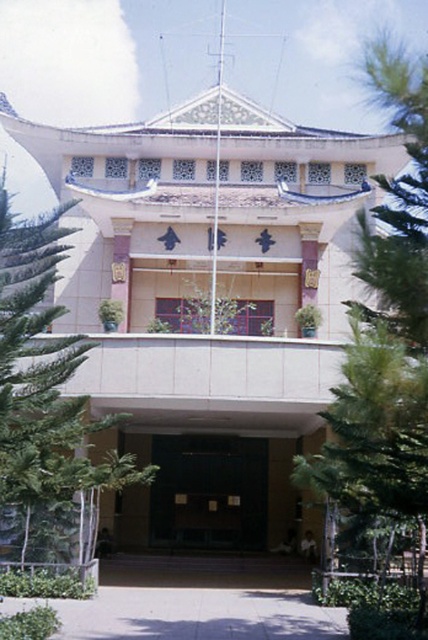
You are standing in front of the building and want to take a photo that includes both the green leafy tree at right and the green leafy tree at left. Which tree should you position closer to the center of your camera frame to ensure both are visible?

You should position the green leafy tree at left closer to the center of your camera frame because it is to the left of the green leafy tree at right, allowing both to be captured within the frame.